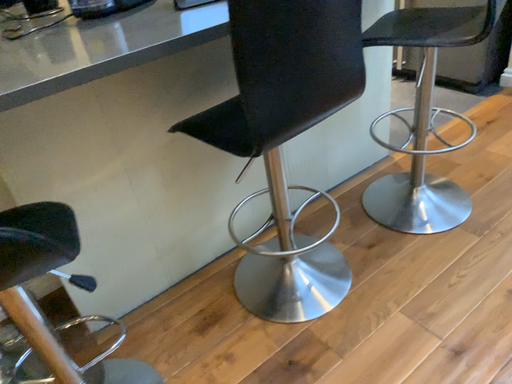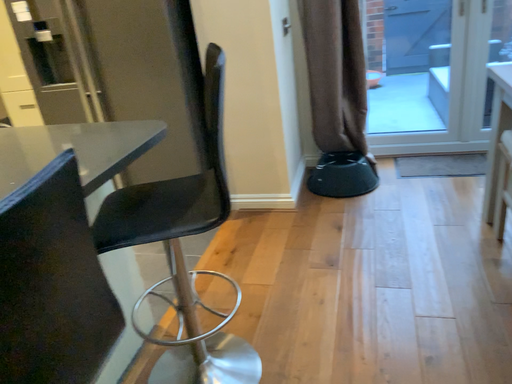
Question: Which way did the camera rotate in the video?

Choices:
 (A) rotated left
 (B) rotated right

Answer: (B)